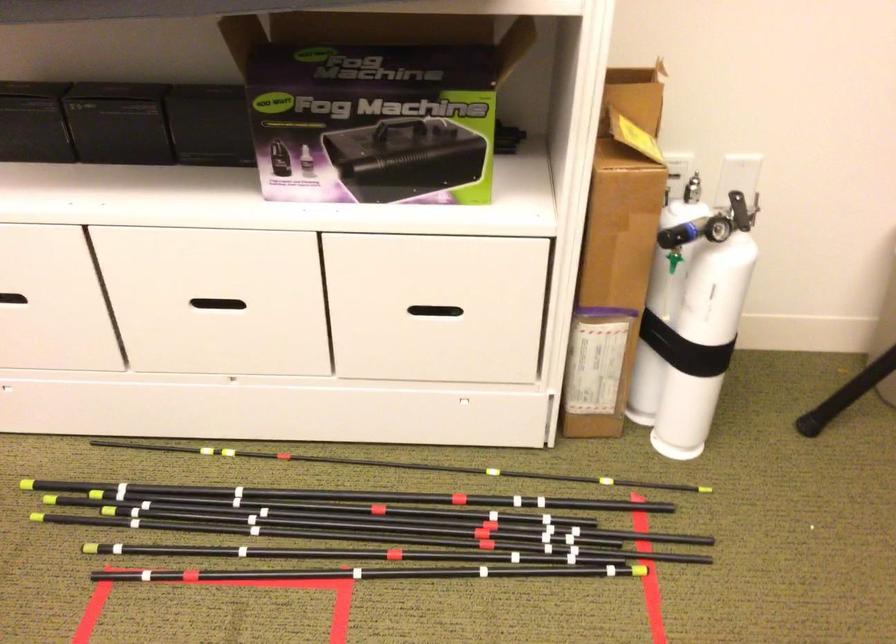
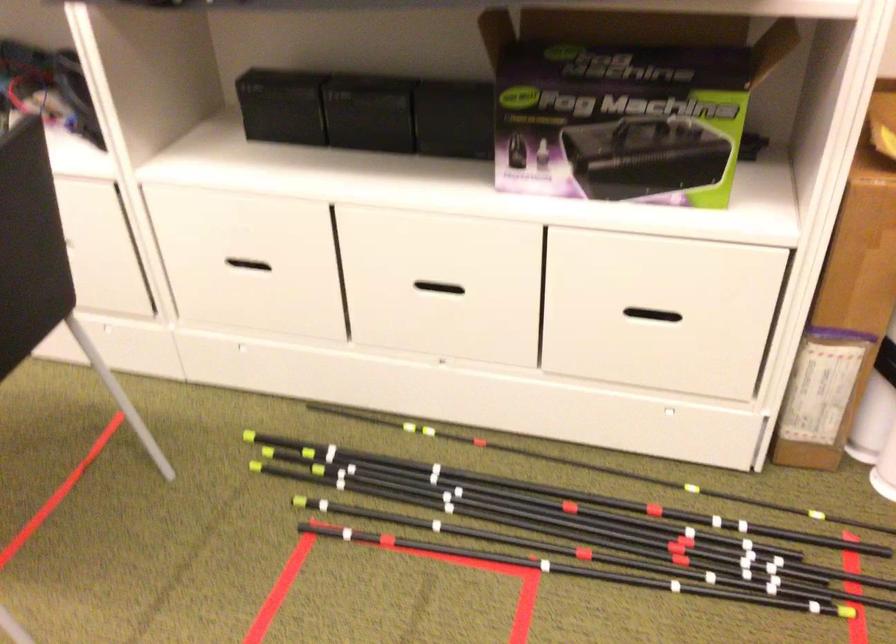
The point at (376, 106) is marked in the first image. Where is the corresponding point in the second image?

(625, 102)